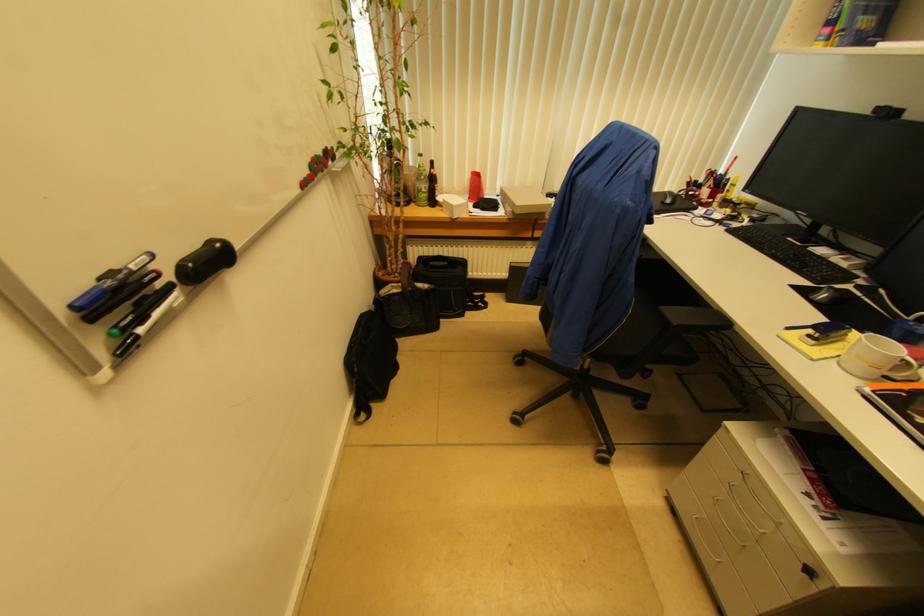
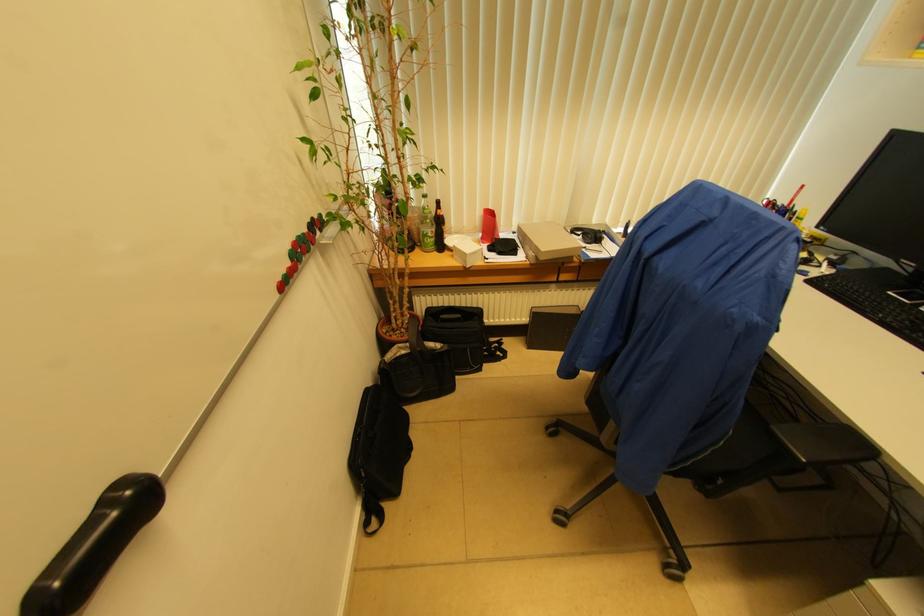
Locate, in the second image, the point that corresponds to pixel 730 180 in the first image.

(796, 215)